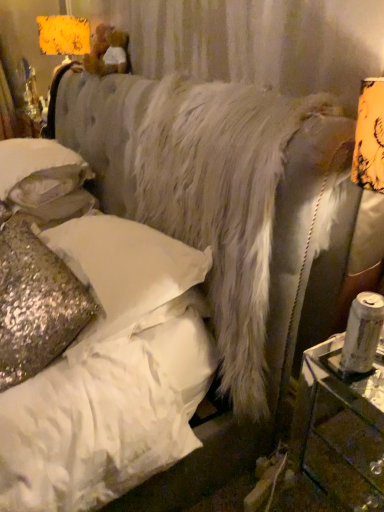
Question: From the image's perspective, is sparkly gold pillow at lower left, which appears as the 3th pillow when viewed from the top, over clear glass table at right?

Choices:
 (A) yes
 (B) no

Answer: (A)

Question: Is sparkly gold pillow at lower left, marked as the 1th pillow in a bottom-to-top arrangement, oriented towards clear glass table at right?

Choices:
 (A) no
 (B) yes

Answer: (A)

Question: Does sparkly gold pillow at lower left, marked as the 1th pillow in a bottom-to-top arrangement, have a smaller size compared to clear glass table at right?

Choices:
 (A) no
 (B) yes

Answer: (A)

Question: Is sparkly gold pillow at lower left, marked as the 1th pillow in a bottom-to-top arrangement, outside of clear glass table at right?

Choices:
 (A) yes
 (B) no

Answer: (A)

Question: Does sparkly gold pillow at lower left, marked as the 1th pillow in a bottom-to-top arrangement, have a lesser width compared to clear glass table at right?

Choices:
 (A) no
 (B) yes

Answer: (B)

Question: Does sparkly gold pillow at lower left, which appears as the 3th pillow when viewed from the top, appear on the left side of clear glass table at right?

Choices:
 (A) no
 (B) yes

Answer: (B)

Question: From the image's perspective, is glittery sequined pillow at lower left, marked as the 2th pillow in a top-to-bottom arrangement, below sparkly gold pillow at lower left, which appears as the 3th pillow when viewed from the top?

Choices:
 (A) yes
 (B) no

Answer: (B)

Question: Can you confirm if glittery sequined pillow at lower left, marked as the 2th pillow in a top-to-bottom arrangement, is thinner than sparkly gold pillow at lower left, which appears as the 3th pillow when viewed from the top?

Choices:
 (A) no
 (B) yes

Answer: (A)

Question: Is glittery sequined pillow at lower left, marked as the 2th pillow in a top-to-bottom arrangement, outside of sparkly gold pillow at lower left, marked as the 1th pillow in a bottom-to-top arrangement?

Choices:
 (A) no
 (B) yes

Answer: (B)

Question: Does glittery sequined pillow at lower left, marked as the 2th pillow in a top-to-bottom arrangement, have a greater width compared to sparkly gold pillow at lower left, marked as the 1th pillow in a bottom-to-top arrangement?

Choices:
 (A) yes
 (B) no

Answer: (A)

Question: Is glittery sequined pillow at lower left, which is the 2th pillow from bottom to top, facing away from sparkly gold pillow at lower left, which appears as the 3th pillow when viewed from the top?

Choices:
 (A) no
 (B) yes

Answer: (A)

Question: Considering the relative sizes of glittery sequined pillow at lower left, which is the 2th pillow from bottom to top, and sparkly gold pillow at lower left, marked as the 1th pillow in a bottom-to-top arrangement, in the image provided, is glittery sequined pillow at lower left, which is the 2th pillow from bottom to top, taller than sparkly gold pillow at lower left, marked as the 1th pillow in a bottom-to-top arrangement,?

Choices:
 (A) yes
 (B) no

Answer: (B)

Question: Is white sequined pillow at upper left, which appears as the 3th pillow when ordered from the bottom, to the left of clear glass table at right from the viewer's perspective?

Choices:
 (A) yes
 (B) no

Answer: (A)